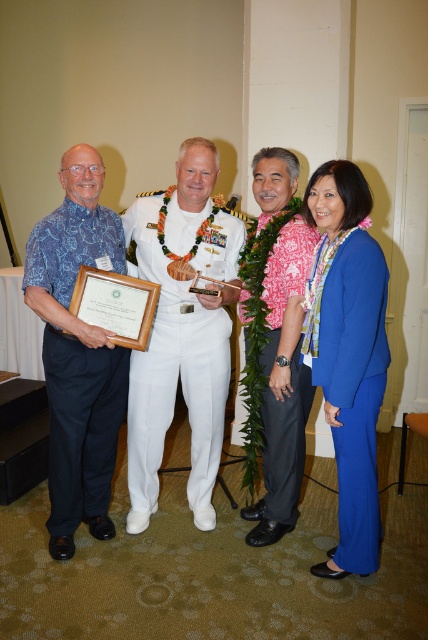
Is blue printed shirt at left in front of pink floral shirt at center?

That is True.

Image resolution: width=428 pixels, height=640 pixels. What do you see at coordinates (77, 352) in the screenshot?
I see `blue printed shirt at left` at bounding box center [77, 352].

Does point (95, 481) come farther from viewer compared to point (267, 259)?

Yes, point (95, 481) is farther from viewer.

The width and height of the screenshot is (428, 640). Identify the location of blue printed shirt at left. (77, 352).

Measure the distance between point (x=101, y=492) and camera.

A distance of 2.63 meters exists between point (x=101, y=492) and camera.

Does blue printed shirt at left have a smaller size compared to matte blue suit at center?

No, blue printed shirt at left is not smaller than matte blue suit at center.

Does point (50, 552) come behind point (344, 196)?

Yes.

In order to click on blue printed shirt at left in this screenshot , I will do `click(77, 352)`.

Between point (196, 316) and point (341, 428), which one is positioned behind?

The point (196, 316) is more distant.

Is white uniform at center closer to camera compared to matte blue suit at center?

No, it is not.

Does point (196, 163) come behind point (333, 170)?

Yes, it is.

Where is `white uniform at center`? The width and height of the screenshot is (428, 640). white uniform at center is located at coordinates (181, 332).